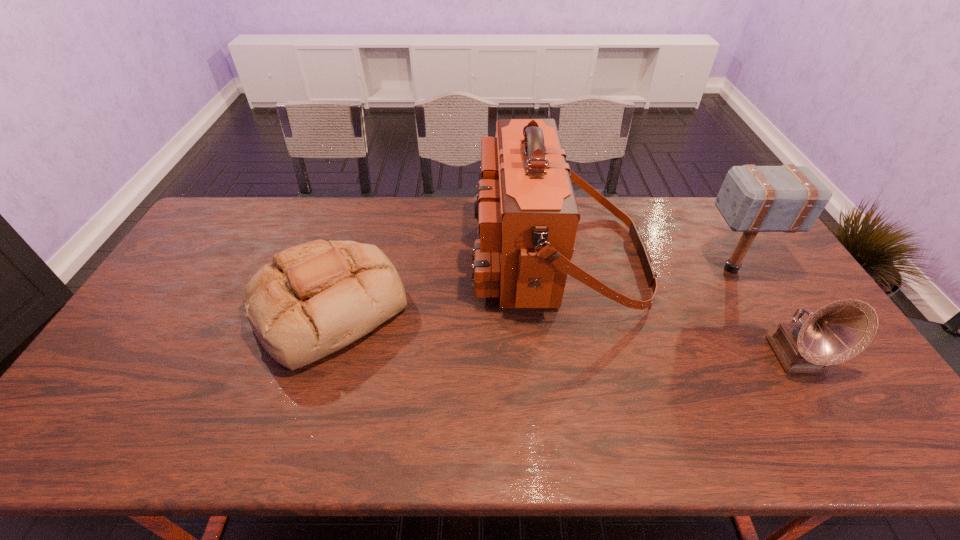
In the image, there is a desktop. Identify the location of vacant space at the right edge. The width and height of the screenshot is (960, 540). (774, 324).

The width and height of the screenshot is (960, 540). What are the coordinates of `blank space at the far left corner` in the screenshot? It's located at (236, 209).

Where is `unoccupied area between the shortest object and the second shortest object`? Image resolution: width=960 pixels, height=540 pixels. unoccupied area between the shortest object and the second shortest object is located at coordinates (563, 332).

Identify the location of free space that is in between the shortest object and the third tallest object. (563, 332).

Locate an element on the screen. The image size is (960, 540). free space between the third object from right to left and the third tallest object is located at coordinates (676, 308).

Locate an element on the screen. blank region between the second shortest object and the mallet is located at coordinates (763, 313).

Locate an element on the screen. Image resolution: width=960 pixels, height=540 pixels. free spot between the third tallest object and the second object from left to right is located at coordinates (676, 308).

Locate an element on the screen. unoccupied position between the mallet and the phonograph record is located at coordinates (763, 313).

I want to click on free area in between the third tallest object and the second tallest object, so click(763, 313).

This screenshot has width=960, height=540. What are the coordinates of `the third closest object to the second tallest object` in the screenshot? It's located at (315, 298).